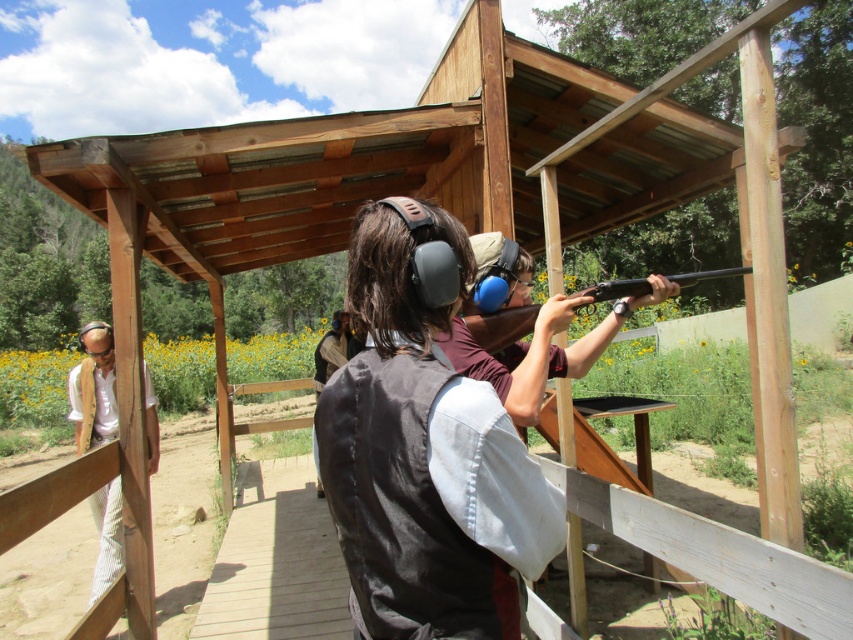
Who is positioned more to the left, dark brown leather vest at center or white striped pants at left?

Positioned to the left is white striped pants at left.

From the picture: Is dark brown leather vest at center closer to camera compared to white striped pants at left?

Yes, dark brown leather vest at center is in front of white striped pants at left.

Is point (383, 611) positioned behind point (91, 346)?

No, it is in front of (91, 346).

You are a GUI agent. You are given a task and a screenshot of the screen. Output one action in this format:
    pyautogui.click(x=<x>, y=<y>)
    Task: Click on the dark brown leather vest at center
    The width and height of the screenshot is (853, 640).
    Given the screenshot: What is the action you would take?
    pyautogui.click(x=424, y=449)

Who is taller, white striped pants at left or matte black shotgun at center?

With more height is white striped pants at left.

Does white striped pants at left have a smaller size compared to matte black shotgun at center?

Yes.

Is point (80, 381) closer to camera compared to point (602, 292)?

That is False.

Find the location of `white striped pants at left`. white striped pants at left is located at coordinates (93, 388).

Between dark brown leather vest at center and matte black shotgun at center, which one has less height?

Standing shorter between the two is dark brown leather vest at center.

Does point (529, 502) lie in front of point (505, 342)?

Yes, point (529, 502) is closer to viewer.

This screenshot has height=640, width=853. Describe the element at coordinates (424, 449) in the screenshot. I see `dark brown leather vest at center` at that location.

Find the location of a particular element. dark brown leather vest at center is located at coordinates (424, 449).